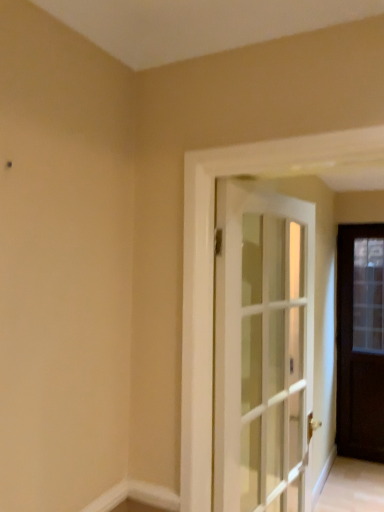
Question: Does white glass door at center, marked as the 2th door in a back-to-front arrangement, come in front of dark wood door at right, the 1th door positioned from the back?

Choices:
 (A) yes
 (B) no

Answer: (A)

Question: Is white glass door at center, marked as the 2th door in a back-to-front arrangement, bigger than dark wood door at right, arranged as the first door when viewed from the right?

Choices:
 (A) yes
 (B) no

Answer: (A)

Question: Is white glass door at center, acting as the second door starting from the right, not inside dark wood door at right, arranged as the first door when viewed from the right?

Choices:
 (A) yes
 (B) no

Answer: (A)

Question: Is white glass door at center, acting as the second door starting from the right, facing away from dark wood door at right, arranged as the first door when viewed from the right?

Choices:
 (A) yes
 (B) no

Answer: (B)

Question: From the image's perspective, is white glass door at center, marked as the 2th door in a back-to-front arrangement, located above dark wood door at right, which is counted as the 2th door, starting from the left?

Choices:
 (A) yes
 (B) no

Answer: (A)

Question: Does point (114, 501) appear closer or farther from the camera than point (243, 269)?

Choices:
 (A) farther
 (B) closer

Answer: (B)

Question: From the image's perspective, is white smooth baseboard at lower center located above or below white glass door at center, which ranks as the first door in front-to-back order?

Choices:
 (A) above
 (B) below

Answer: (B)

Question: From a real-world perspective, relative to white glass door at center, which ranks as the first door in front-to-back order, is white smooth baseboard at lower center vertically above or below?

Choices:
 (A) above
 (B) below

Answer: (B)

Question: Is white smooth baseboard at lower center wider or thinner than white glass door at center, the first door positioned from the left?

Choices:
 (A) wide
 (B) thin

Answer: (B)

Question: Is white glass door at center, which ranks as the first door in front-to-back order, situated inside dark wood door at right, which is the second door in front-to-back order, or outside?

Choices:
 (A) inside
 (B) outside

Answer: (B)

Question: From their relative heights in the image, would you say white glass door at center, the first door positioned from the left, is taller or shorter than dark wood door at right, which is the second door in front-to-back order?

Choices:
 (A) short
 (B) tall

Answer: (A)

Question: Considering the positions of white glass door at center, marked as the 2th door in a back-to-front arrangement, and dark wood door at right, the 1th door positioned from the back, in the image, is white glass door at center, marked as the 2th door in a back-to-front arrangement, bigger or smaller than dark wood door at right, the 1th door positioned from the back,?

Choices:
 (A) small
 (B) big

Answer: (B)

Question: From the image's perspective, relative to dark wood door at right, the 1th door positioned from the back, is white glass door at center, the first door positioned from the left, above or below?

Choices:
 (A) above
 (B) below

Answer: (A)

Question: Is white smooth baseboard at lower center inside or outside of dark wood door at right, arranged as the first door when viewed from the right?

Choices:
 (A) outside
 (B) inside

Answer: (A)

Question: In terms of height, does white smooth baseboard at lower center look taller or shorter compared to dark wood door at right, arranged as the first door when viewed from the right?

Choices:
 (A) short
 (B) tall

Answer: (A)